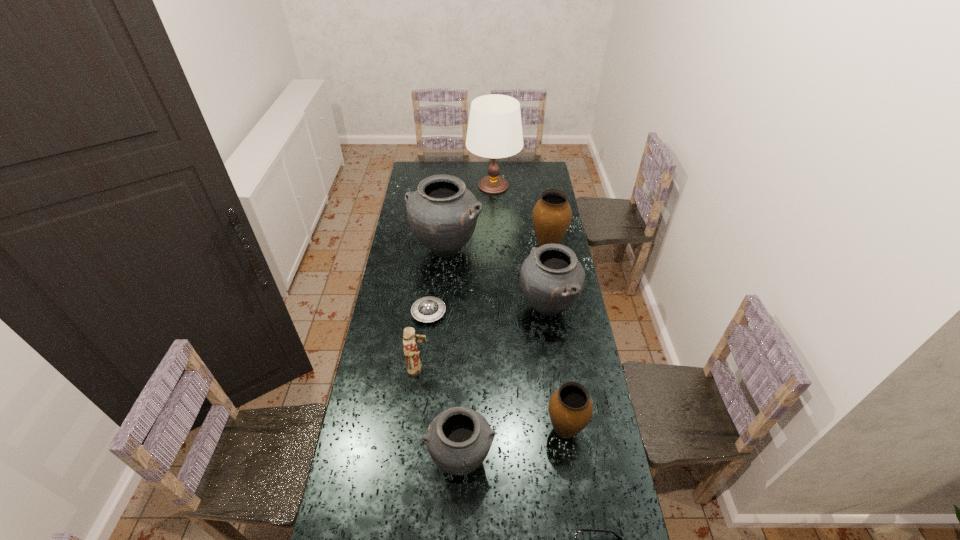
Locate an element on the screen. unoccupied position between the rightmost black urn and the tallest urn is located at coordinates (497, 278).

The image size is (960, 540). Identify the location of free space between the farthest black urn and the farther brown urn. (497, 248).

In order to click on object that can be found as the eighth closest to the figurine in this screenshot , I will do `click(494, 131)`.

Point out which object is positioned as the third nearest to the tallest urn. Please provide its 2D coordinates. Your answer should be formatted as a tuple, i.e. [(x, y)], where the tuple contains the x and y coordinates of a point satisfying the conditions above.

[(552, 214)]

Image resolution: width=960 pixels, height=540 pixels. In order to click on urn that is the third nearest to the smaller brown urn in this screenshot , I will do `click(442, 213)`.

Select which urn appears as the fourth closest to the farthest object. Please provide its 2D coordinates. Your answer should be formatted as a tuple, i.e. [(x, y)], where the tuple contains the x and y coordinates of a point satisfying the conditions above.

[(570, 408)]

I want to click on black urn that is the closest to the saucer, so click(x=442, y=213).

Identify which black urn is located as the second nearest to the saucer. Please provide its 2D coordinates. Your answer should be formatted as a tuple, i.e. [(x, y)], where the tuple contains the x and y coordinates of a point satisfying the conditions above.

[(551, 278)]

At what (x,y) coordinates should I click in order to perform the action: click on free region that satisfies the following two spatial constraints: 1. on the front side of the nearest black urn; 2. on the right side of the saucer. Please return your answer as a coordinate pair (x, y). Image resolution: width=960 pixels, height=540 pixels. Looking at the image, I should click on coord(413,458).

Find the location of a particular element. free location that satisfies the following two spatial constraints: 1. on the front-facing side of the figurine; 2. on the right side of the smallest black urn is located at coordinates (408, 458).